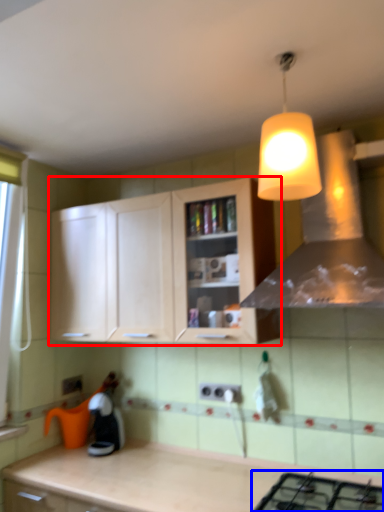
Question: Which object is closer to the camera taking this photo, cabinetry (highlighted by a red box) or gas stove (highlighted by a blue box)?

Choices:
 (A) cabinetry
 (B) gas stove

Answer: (B)